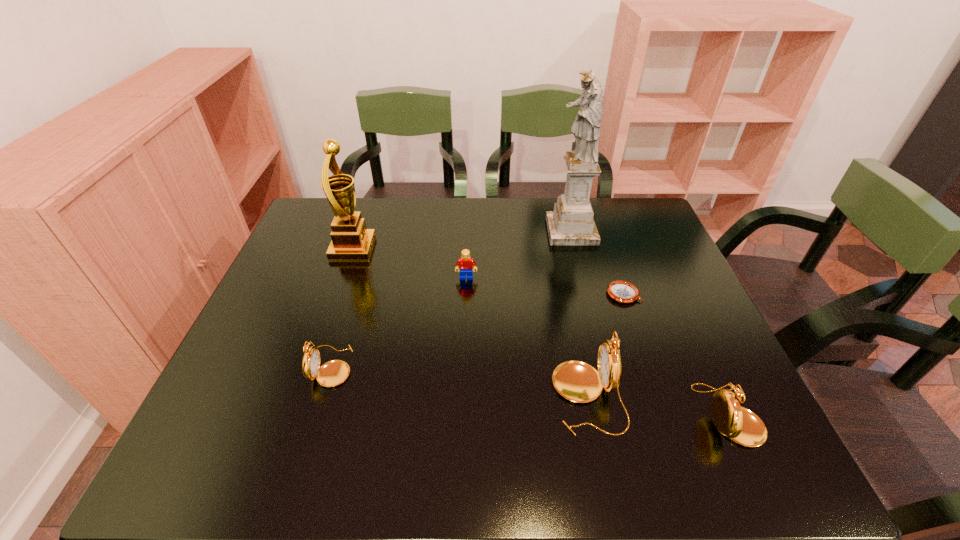
What are the coordinates of `vacant space located on the front of the compass` in the screenshot? It's located at (642, 348).

I want to click on sculpture that is at the far edge, so click(x=571, y=223).

At what (x,y) coordinates should I click in order to perform the action: click on award at the far edge. Please return your answer as a coordinate pair (x, y). The width and height of the screenshot is (960, 540). Looking at the image, I should click on (351, 240).

I want to click on object located in the left edge section of the desktop, so click(x=351, y=240).

Locate an element on the screen. This screenshot has width=960, height=540. pocket watch at the right edge is located at coordinates (741, 425).

Identify the location of compass situated at the right edge. The height and width of the screenshot is (540, 960). (620, 291).

I want to click on object that is at the far left corner, so click(351, 240).

Identify the location of object at the near right corner. Image resolution: width=960 pixels, height=540 pixels. (741, 425).

Find the location of a particular element. The height and width of the screenshot is (540, 960). vacant space at the far edge of the desktop is located at coordinates (373, 198).

You are a GUI agent. You are given a task and a screenshot of the screen. Output one action in this format:
    pyautogui.click(x=<x>, y=<y>)
    Task: Click on the blank space at the left edge of the desktop
    The height and width of the screenshot is (540, 960).
    Given the screenshot: What is the action you would take?
    pyautogui.click(x=247, y=360)